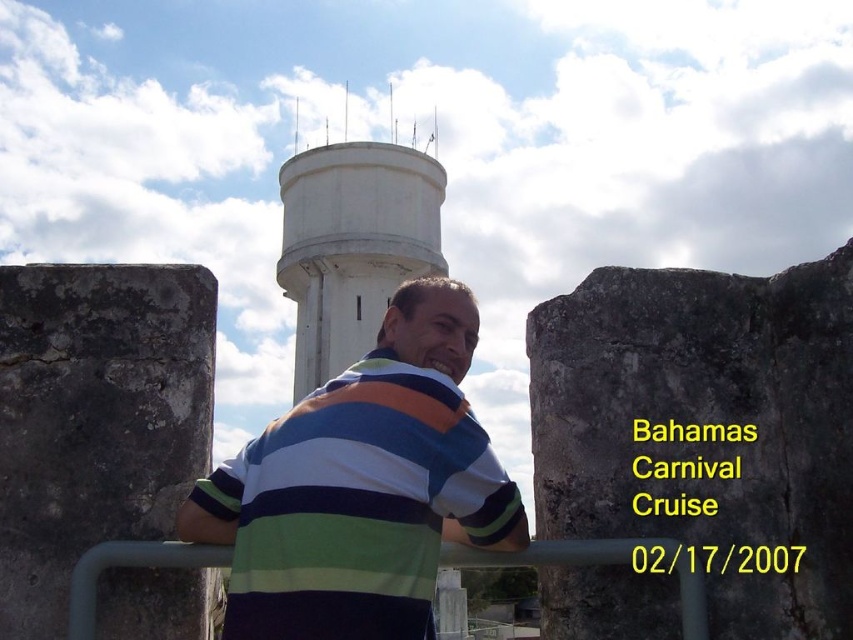
You are a photographer trying to capture the striped cotton shirt at center and the white concrete water tower at center in the same frame. Based on their positions, which object should you adjust your camera to focus on first if you want to include both in your shot?

The striped cotton shirt at center is to the right of the white concrete water tower at center. To include both in the frame, you should adjust your camera to focus on the white concrete water tower at center first since it is on the left side, allowing you to pan right to include the striped cotton shirt at center in the shot.

You are a photographer trying to capture a photo of the man standing near the stone walls. You are currently at the point marked as point [318,157]. If the camera you are using has a maximum focus range of 500 feet, will you be able to take a clear photo of the man?

The distance between point [318,157] and the camera is 519.34 feet, which exceeds the camera maximum focus range of 500 feet. Therefore, you will not be able to take a clear photo of the man.

You are a photographer trying to capture a wide shot of the scene. The gray rough stone at center and the striped cotton shirt at center are both in the frame. Which object would require you to adjust your camera to a wider angle to fully capture in the photo?

The gray rough stone at center has a larger width than the striped cotton shirt at center, so you would need to adjust the camera to a wider angle to fully capture the gray rough stone at center.